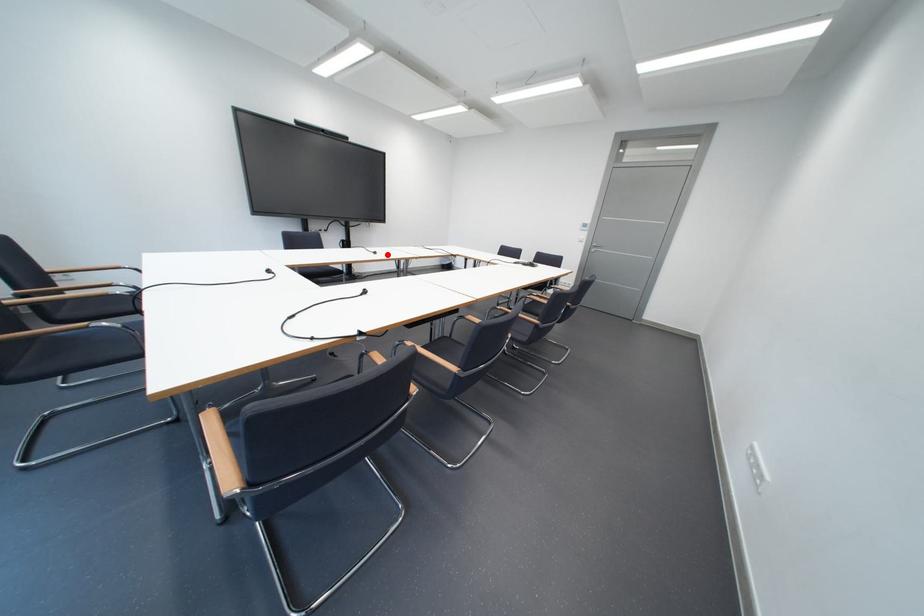
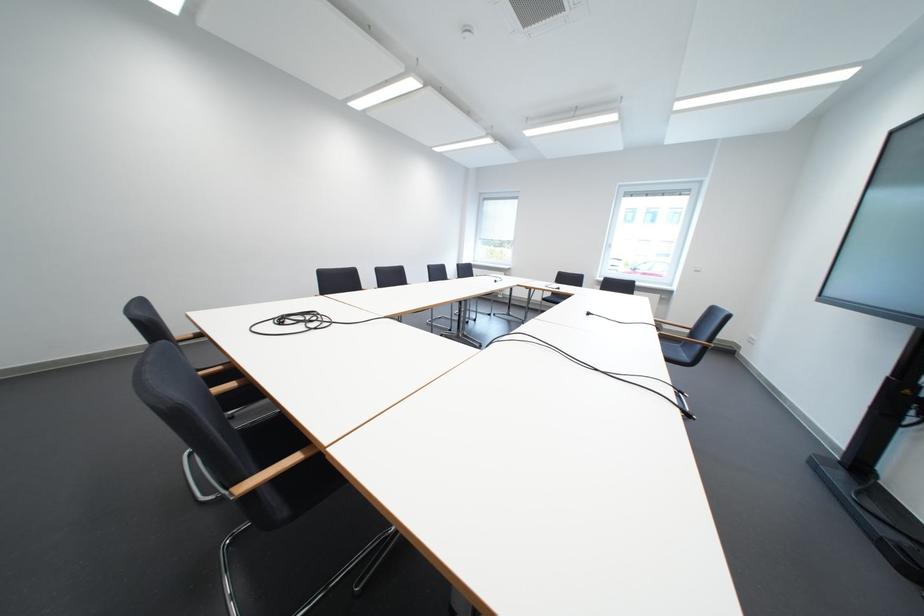
Where in the second image is the point corresponding to the highlighted location from the first image?

(601, 315)